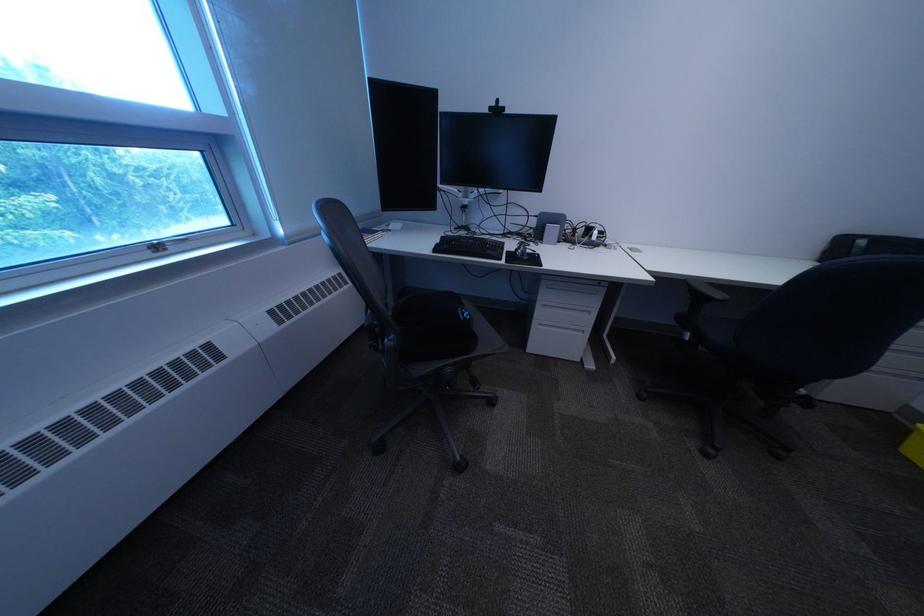
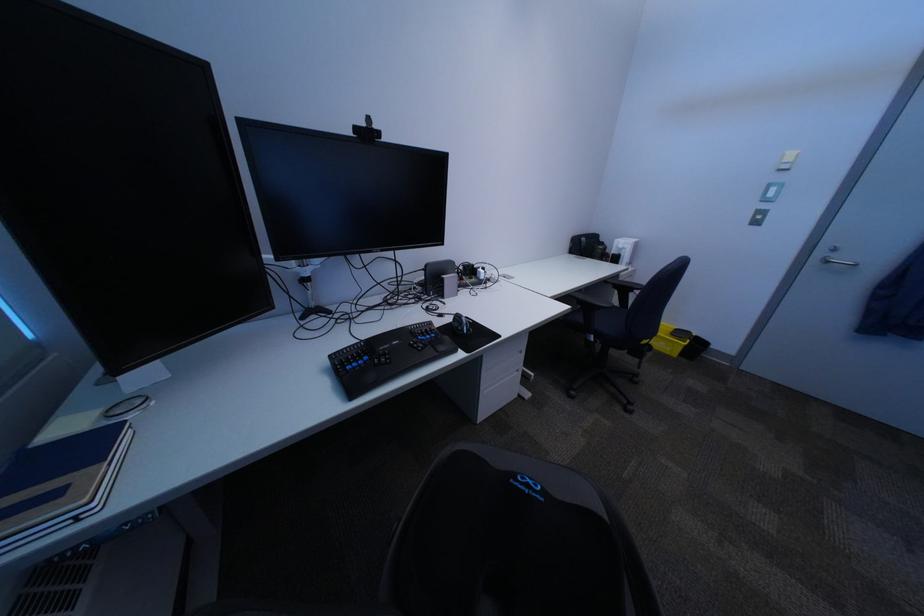
Question: I am providing you with two images of the same scene from different viewpoints. After the viewpoint changes to image2, which objects are now occluded?

Choices:
 (A) blue notebook
 (B) black computer mouse
 (C) white light switch
 (D) none of these

Answer: (D)